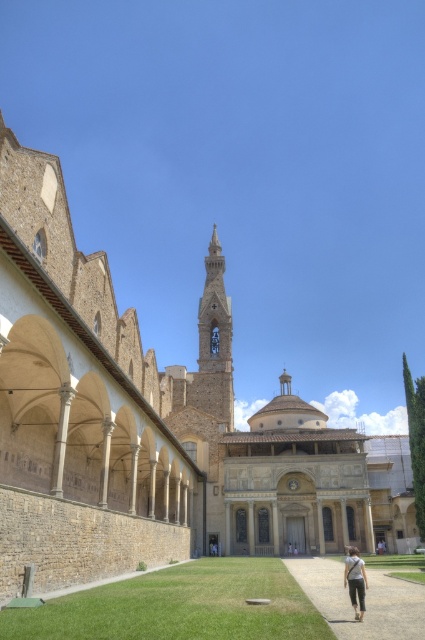
Can you confirm if green grass at lower center is positioned to the right of gravel path at center?

No, green grass at lower center is not to the right of gravel path at center.

Does green grass at lower center appear under gravel path at center?

No, green grass at lower center is not below gravel path at center.

What do you see at coordinates (178, 605) in the screenshot? I see `green grass at lower center` at bounding box center [178, 605].

Locate an element on the screen. The height and width of the screenshot is (640, 425). green grass at lower center is located at coordinates (178, 605).

Between point (221, 376) and point (362, 593), which one is positioned in front?

Point (362, 593)

Which is behind, point (231, 330) or point (362, 609)?

The point (231, 330) is behind.

This screenshot has width=425, height=640. What are the coordinates of `smooth stone tower at center` in the screenshot? It's located at (214, 342).

At what (x,y) coordinates should I click in order to perform the action: click on smooth stone tower at center. Please return your answer as a coordinate pair (x, y). The height and width of the screenshot is (640, 425). Looking at the image, I should click on coord(214,342).

Who is higher up, gravel path at center or light brown fabric pants at lower right?

gravel path at center

Measure the distance between point (306, 588) and camera.

Point (306, 588) is 164.01 feet away from camera.

Find the location of `gravel path at center`. gravel path at center is located at coordinates (365, 600).